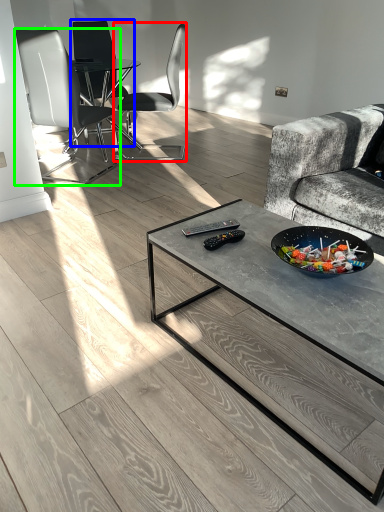
Question: Which object is positioned closest to chair (highlighted by a red box)? Select from chair (highlighted by a blue box) and chair (highlighted by a green box).

Choices:
 (A) chair
 (B) chair

Answer: (A)